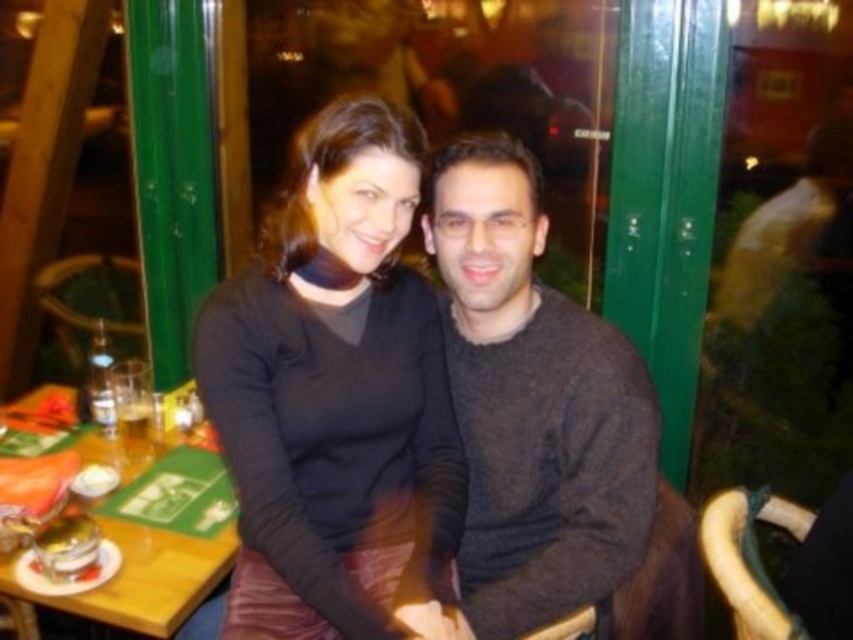
Between dark gray sweater at center and wooden table at lower left, which one appears on the right side from the viewer's perspective?

dark gray sweater at center

How far apart are dark gray sweater at center and wooden table at lower left?

24.54 inches

I want to click on dark gray sweater at center, so click(532, 403).

Between point (364, 310) and point (10, 582), which one is positioned in front?

Point (10, 582)

From the picture: Does black matte sweater at center have a greater height compared to wooden table at lower left?

Indeed, black matte sweater at center has a greater height compared to wooden table at lower left.

Which is in front, point (344, 611) or point (157, 556)?

Point (344, 611)

The image size is (853, 640). What are the coordinates of `black matte sweater at center` in the screenshot? It's located at (335, 392).

Which is in front, point (372, 268) or point (463, 232)?

Point (372, 268)

You are a GUI agent. You are given a task and a screenshot of the screen. Output one action in this format:
    pyautogui.click(x=<x>, y=<y>)
    Task: Click on the black matte sweater at center
    Image resolution: width=853 pixels, height=640 pixels.
    Given the screenshot: What is the action you would take?
    pyautogui.click(x=335, y=392)

Is point (340, 486) more distant than point (546, 595)?

Yes, point (340, 486) is behind point (546, 595).

The image size is (853, 640). I want to click on black matte sweater at center, so click(x=335, y=392).